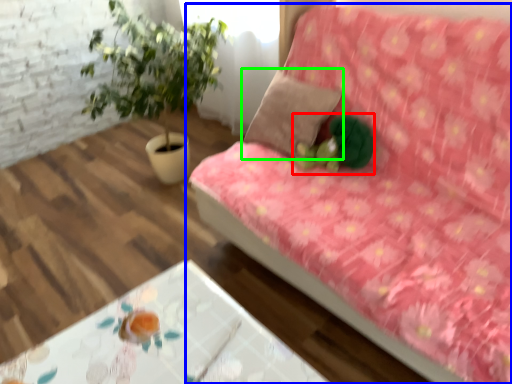
Question: Considering the real-world distances, which object is closest to toy (highlighted by a red box)? studio couch (highlighted by a blue box) or pillow (highlighted by a green box).

Choices:
 (A) studio couch
 (B) pillow

Answer: (B)